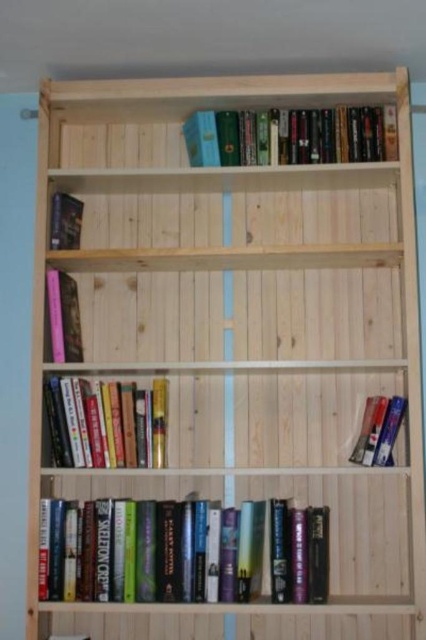
You are organizing books on a wooden bookshelf. You have two hardcover books to place. The first is the hardcover book at left, and the second is the hardcover books at center. Which book should you place on the third shelf if you want to maximize the vertical space available?

The hardcover books at center is much taller than the hardcover book at left, so placing the hardcover books at center on the third shelf would better utilize the vertical space available.

You are organizing books on a wooden bookshelf. You have two books to place next to each other. The first is a hardcover book at left and the second is hardcover books at lower center. Based on their positions, which book should you place to the left to maintain the current arrangement?

The hardcover book at left should be placed to the left since it is already positioned to the left of the hardcover books at lower center.

You are standing in front of the wooden bookshelf and want to reach two specific points on the shelves. The first point is at coordinate point (x=94, y=419) and the second is at point (x=68, y=211). Which point is closer to you?

Point (x=94, y=419) is closer to the camera than point (x=68, y=211), so the first point is closer to you.